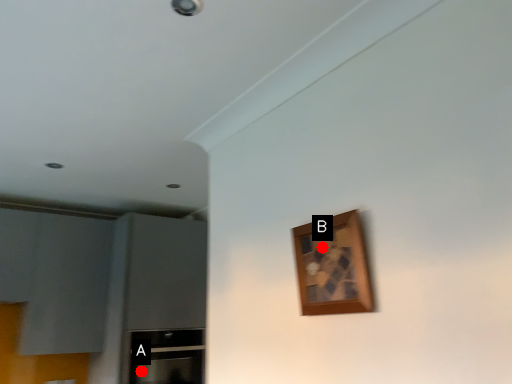
Question: Two points are circled on the image, labeled by A and B beside each circle. Which point appears closest to the camera in this image?

Choices:
 (A) A is closer
 (B) B is closer

Answer: (B)